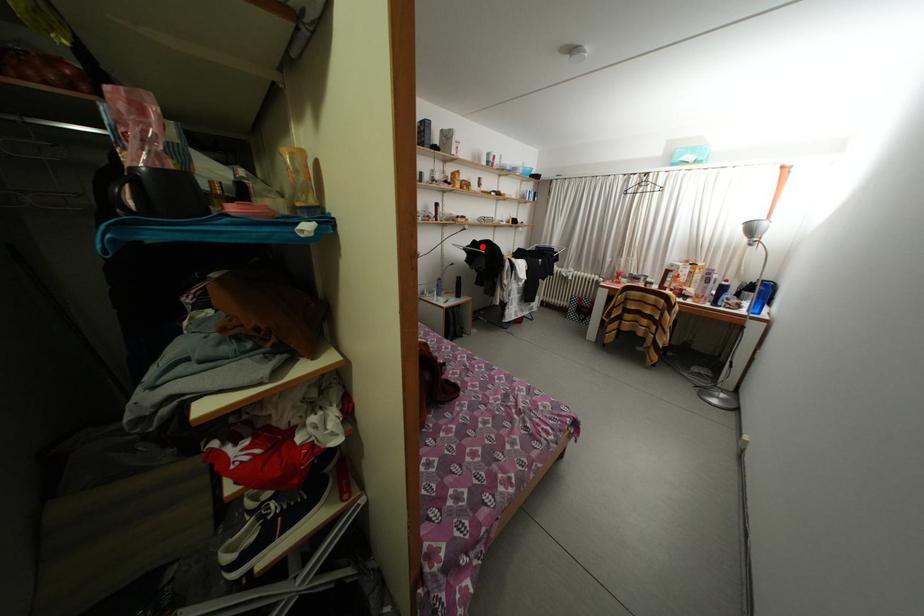
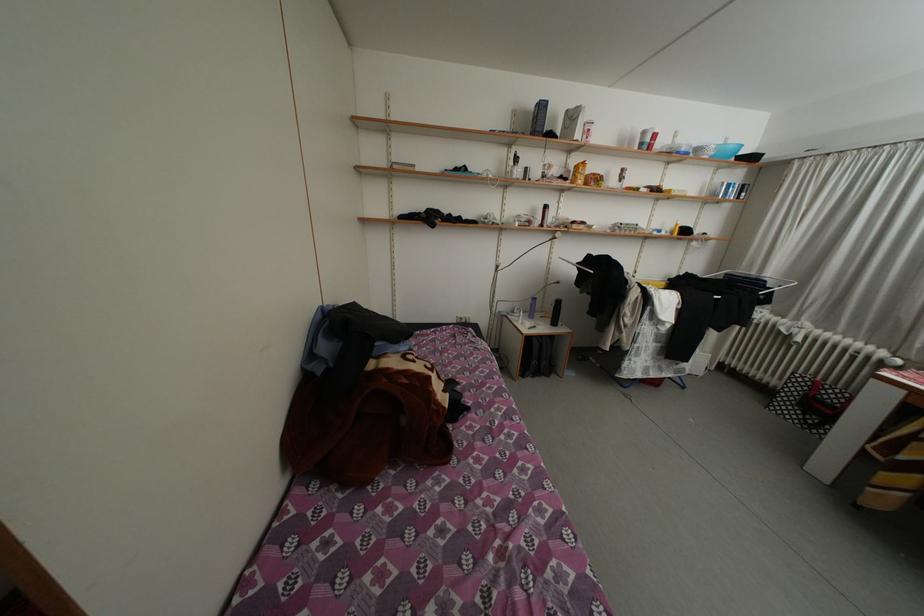
Question: I am providing you with two images of the same scene from different viewpoints. A red point is marked on the first image. Is the red point's position out of view in image 2?

Choices:
 (A) Yes
 (B) No

Answer: (B)